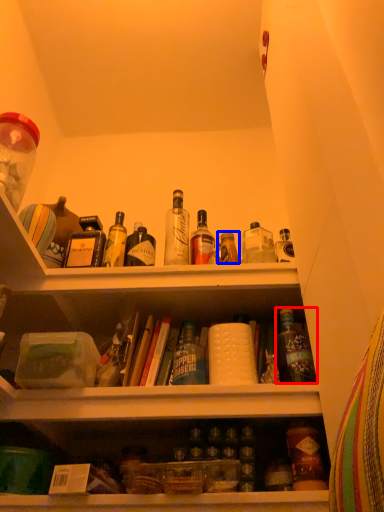
Question: Which point is closer to the camera, bottle (highlighted by a red box) or bottle (highlighted by a blue box)?

Choices:
 (A) bottle
 (B) bottle

Answer: (A)